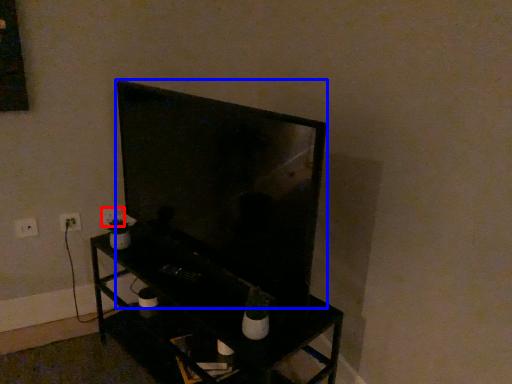
Question: Which object is closer to the camera taking this photo, electric outlet (highlighted by a red box) or television (highlighted by a blue box)?

Choices:
 (A) electric outlet
 (B) television

Answer: (B)